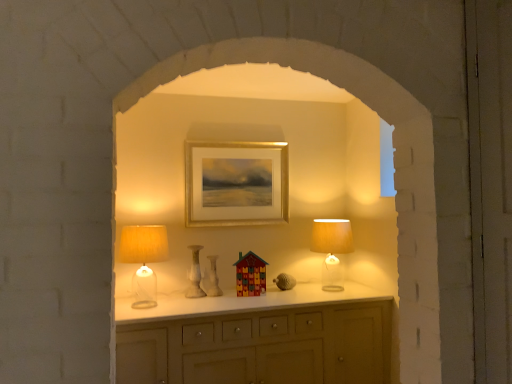
What is the approximate height of white glossy vase at center, acting as the second vase starting from the left?

30.51 centimeters.

Image resolution: width=512 pixels, height=384 pixels. Identify the location of matte yellow fabric lampshade at left, which is the second table lamp from back to front. (144, 259).

Based on their positions, is white marble vase at center, the second vase viewed from the right, located to the left or right of white glossy vase at center, acting as the second vase starting from the left?

In the image, white marble vase at center, the second vase viewed from the right, appears on the left side of white glossy vase at center, acting as the second vase starting from the left.

Is white marble vase at center, the second vase viewed from the right, positioned in front of white glossy vase at center, the first vase when ordered from right to left?

That is True.

Can you confirm if white marble vase at center, the second vase viewed from the right, is taller than white glossy vase at center, the first vase when ordered from right to left?

Yes, white marble vase at center, the second vase viewed from the right, is taller than white glossy vase at center, the first vase when ordered from right to left.

From the image's perspective, is translucent glass table lamp at right, which appears as the second table lamp when viewed from the front, above or below white marble vase at center, the second vase viewed from the right?

From the image's perspective, translucent glass table lamp at right, which appears as the second table lamp when viewed from the front, appears above white marble vase at center, the second vase viewed from the right.

Does translucent glass table lamp at right, marked as the second table lamp in a left-to-right arrangement, have a greater width compared to white marble vase at center, which is the 1th vase from left to right?

Correct, the width of translucent glass table lamp at right, marked as the second table lamp in a left-to-right arrangement, exceeds that of white marble vase at center, which is the 1th vase from left to right.

Considering the positions of objects translucent glass table lamp at right, acting as the first table lamp starting from the back, and white marble vase at center, which is the 1th vase from left to right, in the image provided, who is more to the right, translucent glass table lamp at right, acting as the first table lamp starting from the back, or white marble vase at center, which is the 1th vase from left to right,?

Positioned to the right is translucent glass table lamp at right, acting as the first table lamp starting from the back.

From the image's perspective, between translucent glass table lamp at right, marked as the second table lamp in a left-to-right arrangement, and matte yellow fabric lampshade at left, the first table lamp when ordered from front to back, which one is located above?

translucent glass table lamp at right, marked as the second table lamp in a left-to-right arrangement, from the image's perspective.

What's the angular difference between translucent glass table lamp at right, marked as the second table lamp in a left-to-right arrangement, and matte yellow fabric lampshade at left, the first table lamp when ordered from front to back,'s facing directions?

The angle between the facing direction of translucent glass table lamp at right, marked as the second table lamp in a left-to-right arrangement, and the facing direction of matte yellow fabric lampshade at left, the first table lamp when ordered from front to back, is 0.00713 degrees.

From a real-world perspective, is translucent glass table lamp at right, acting as the first table lamp starting from the back, positioned over matte yellow fabric lampshade at left, the first table lamp positioned from the left, based on gravity?

Yes, from a real-world perspective, translucent glass table lamp at right, acting as the first table lamp starting from the back, is above matte yellow fabric lampshade at left, the first table lamp positioned from the left.

Who is shorter, translucent glass table lamp at right, acting as the first table lamp starting from the back, or matte yellow fabric lampshade at left, the first table lamp positioned from the left?

translucent glass table lamp at right, acting as the first table lamp starting from the back.

Is white marble vase at center, the second vase viewed from the right, looking in the opposite direction of matte yellow fabric lampshade at left, which is the second table lamp from back to front?

No, matte yellow fabric lampshade at left, which is the second table lamp from back to front, is not at the back of white marble vase at center, the second vase viewed from the right.

Is white marble vase at center, which is the 1th vase from left to right, positioned in front of matte yellow fabric lampshade at left, which is the second table lamp from back to front?

No, white marble vase at center, which is the 1th vase from left to right, is further to the viewer.

Consider the image. From a real-world perspective, which object rests below the other?

From a 3D spatial view, white marble vase at center, the second vase viewed from the right, is below.

From a real-world perspective, is matte yellow fabric lampshade at left, the first table lamp positioned from the left, under white marble vase at center, which is the 1th vase from left to right?

Incorrect, from a real-world perspective, matte yellow fabric lampshade at left, the first table lamp positioned from the left, is higher than white marble vase at center, which is the 1th vase from left to right.

What's the angular difference between matte yellow fabric lampshade at left, the first table lamp positioned from the left, and white marble vase at center, the second vase viewed from the right,'s facing directions?

They differ by 1.42 degrees in their facing directions.

Considering the sizes of objects matte yellow fabric lampshade at left, which is the second table lamp from back to front, and white marble vase at center, the second vase viewed from the right, in the image provided, who is shorter, matte yellow fabric lampshade at left, which is the second table lamp from back to front, or white marble vase at center, the second vase viewed from the right,?

white marble vase at center, the second vase viewed from the right, is shorter.

Who is more distant, matte yellow fabric lampshade at left, which is the second table lamp from back to front, or white marble vase at center, which is the 1th vase from left to right?

white marble vase at center, which is the 1th vase from left to right, is behind.

Can you tell me how much wooden multicolored house at center and translucent glass table lamp at right, marked as the second table lamp in a left-to-right arrangement, differ in facing direction?

wooden multicolored house at center and translucent glass table lamp at right, marked as the second table lamp in a left-to-right arrangement, are facing 14 degrees away from each other.

Which of these two, wooden multicolored house at center or translucent glass table lamp at right, the 1th table lamp in the right-to-left sequence, is bigger?

Bigger between the two is translucent glass table lamp at right, the 1th table lamp in the right-to-left sequence.

From the image's perspective, which object appears higher, wooden multicolored house at center or translucent glass table lamp at right, marked as the second table lamp in a left-to-right arrangement?

translucent glass table lamp at right, marked as the second table lamp in a left-to-right arrangement.

Which object is positioned more to the right, wooden multicolored house at center or translucent glass table lamp at right, the 1th table lamp in the right-to-left sequence?

From the viewer's perspective, translucent glass table lamp at right, the 1th table lamp in the right-to-left sequence, appears more on the right side.

Is wooden multicolored house at center taller or shorter than white glossy vase at center, acting as the second vase starting from the left?

Considering their sizes, wooden multicolored house at center has more height than white glossy vase at center, acting as the second vase starting from the left.

Does point (240, 286) appear closer or farther from the camera than point (209, 270)?

Point (240, 286) is positioned closer to the camera compared to point (209, 270).

From the image's perspective, is wooden multicolored house at center below white glossy vase at center, acting as the second vase starting from the left?

No, from the image's perspective, wooden multicolored house at center is not below white glossy vase at center, acting as the second vase starting from the left.

From a real-world perspective, relative to white glossy vase at center, acting as the second vase starting from the left, is wooden multicolored house at center vertically above or below?

From a real-world perspective, wooden multicolored house at center is physically above white glossy vase at center, acting as the second vase starting from the left.

The image size is (512, 384). I want to click on vase located in front of the white glossy vase at center, acting as the second vase starting from the left, so click(195, 274).

At what (x,y) coordinates should I click in order to perform the action: click on table lamp behind the white marble vase at center, the second vase viewed from the right. Please return your answer as a coordinate pair (x, y). Looking at the image, I should click on (332, 249).

Consider the image. Based on their spatial positions, is white glossy vase at center, the first vase when ordered from right to left, or wooden multicolored house at center closer to gold metallic picture frame at center?

Based on the image, wooden multicolored house at center appears to be nearer to gold metallic picture frame at center.

Looking at the image, which one is located further to white marble vase at center, which is the 1th vase from left to right, matte yellow fabric lampshade at left, the first table lamp positioned from the left, or gold metallic picture frame at center?

gold metallic picture frame at center lies further to white marble vase at center, which is the 1th vase from left to right, than the other object.

Estimate the real-world distances between objects in this image. Which object is closer to wooden multicolored house at center, white glossy vase at center, the first vase when ordered from right to left, or matte yellow fabric lampshade at left, which ranks as the second table lamp in right-to-left order?

white glossy vase at center, the first vase when ordered from right to left, is positioned closer to the anchor wooden multicolored house at center.

From the image, which object appears to be nearer to white marble vase at center, the second vase viewed from the right, wooden multicolored house at center or white glossy vase at center, the first vase when ordered from right to left?

The object closer to white marble vase at center, the second vase viewed from the right, is white glossy vase at center, the first vase when ordered from right to left.

Based on their spatial positions, is translucent glass table lamp at right, marked as the second table lamp in a left-to-right arrangement, or white marble vase at center, which is the 1th vase from left to right, further from wooden multicolored house at center?

The object further to wooden multicolored house at center is translucent glass table lamp at right, marked as the second table lamp in a left-to-right arrangement.

When comparing their distances from white glossy vase at center, acting as the second vase starting from the left, does translucent glass table lamp at right, marked as the second table lamp in a left-to-right arrangement, or matte yellow fabric lampshade at left, the first table lamp positioned from the left, seem further?

translucent glass table lamp at right, marked as the second table lamp in a left-to-right arrangement, is further to white glossy vase at center, acting as the second vase starting from the left.

In the scene shown: Looking at the image, which one is located closer to matte yellow fabric lampshade at left, the first table lamp when ordered from front to back, wooden multicolored house at center or white glossy vase at center, acting as the second vase starting from the left?

white glossy vase at center, acting as the second vase starting from the left, lies closer to matte yellow fabric lampshade at left, the first table lamp when ordered from front to back, than the other object.

From the picture: From the image, which object appears to be farther from matte yellow fabric lampshade at left, which ranks as the second table lamp in right-to-left order, gold metallic picture frame at center or white glossy vase at center, acting as the second vase starting from the left?

gold metallic picture frame at center is positioned further to the anchor matte yellow fabric lampshade at left, which ranks as the second table lamp in right-to-left order.

You are a GUI agent. You are given a task and a screenshot of the screen. Output one action in this format:
    pyautogui.click(x=<x>, y=<y>)
    Task: Click on the vase between gold metallic picture frame at center and wooden multicolored house at center in the up-down direction
    This screenshot has width=512, height=384.
    Given the screenshot: What is the action you would take?
    pyautogui.click(x=195, y=274)

Find the location of a particular element. toy between white marble vase at center, the second vase viewed from the right, and translucent glass table lamp at right, acting as the first table lamp starting from the back is located at coordinates (250, 275).

The width and height of the screenshot is (512, 384). I want to click on toy between gold metallic picture frame at center and white glossy vase at center, the first vase when ordered from right to left, in the vertical direction, so click(250, 275).

Identify the location of vase between white marble vase at center, which is the 1th vase from left to right, and wooden multicolored house at center. This screenshot has height=384, width=512. (212, 278).